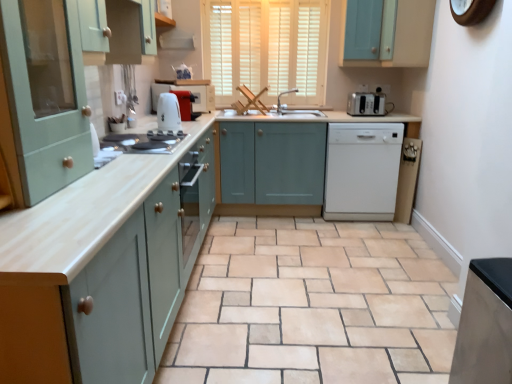
Locate an element on the screen. Image resolution: width=512 pixels, height=384 pixels. unoccupied region to the right of matte green cabinet at left, which is the fourth cabinetry from right to left is located at coordinates (108, 189).